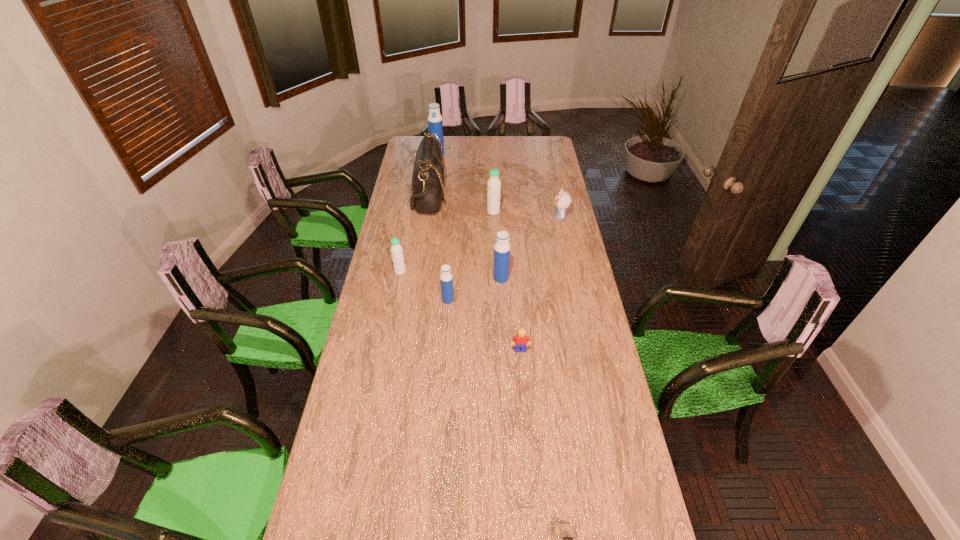
Image resolution: width=960 pixels, height=540 pixels. In the image, there is a desktop. Find the location of `free space at the left edge`. free space at the left edge is located at coordinates (376, 323).

The image size is (960, 540). In order to click on vacant area at the right edge in this screenshot , I will do `click(558, 180)`.

Identify the location of vacant space at the far left corner. (417, 139).

Locate an element on the screen. The image size is (960, 540). free spot between the second blue water bottle from right to left and the rightmost blue water bottle is located at coordinates (474, 289).

At what (x,y) coordinates should I click in order to perform the action: click on vacant space in between the nearer white water bottle and the right white water bottle. Please return your answer as a coordinate pair (x, y). This screenshot has width=960, height=540. Looking at the image, I should click on (446, 242).

Locate an element on the screen. Image resolution: width=960 pixels, height=540 pixels. free area in between the bigger white water bottle and the nearer white water bottle is located at coordinates (446, 242).

Where is `vacant area that lies between the second blue water bottle from left to right and the leftmost water bottle`? vacant area that lies between the second blue water bottle from left to right and the leftmost water bottle is located at coordinates (424, 286).

The image size is (960, 540). Identify the location of vacant region between the second shortest object and the right white water bottle. (507, 281).

Where is `object that can be found as the fourth closest to the Lego`? object that can be found as the fourth closest to the Lego is located at coordinates (x=396, y=249).

Image resolution: width=960 pixels, height=540 pixels. Find the location of `object that is the sixth closest to the nearest water bottle`. object that is the sixth closest to the nearest water bottle is located at coordinates (562, 200).